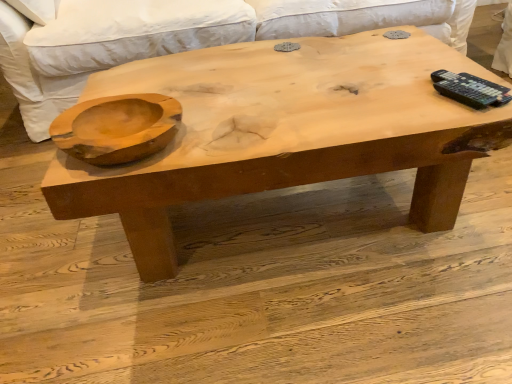
You are a GUI agent. You are given a task and a screenshot of the screen. Output one action in this format:
    pyautogui.click(x=<x>, y=<y>)
    Task: Click on the vacant space underneath natural wood coffee table at center (from a real-world perspective)
    This screenshot has width=512, height=384.
    Given the screenshot: What is the action you would take?
    pyautogui.click(x=291, y=217)